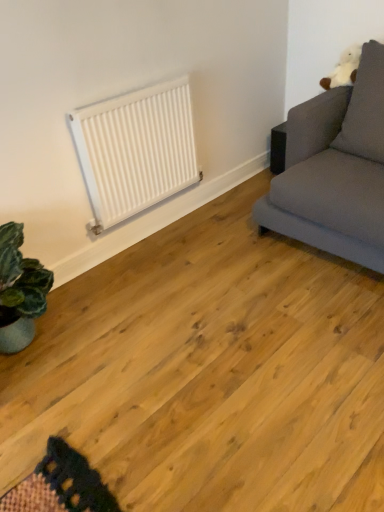
Locate an element on the screen. The image size is (384, 512). blank area to the left of gray fabric couch at upper right is located at coordinates (x=211, y=263).